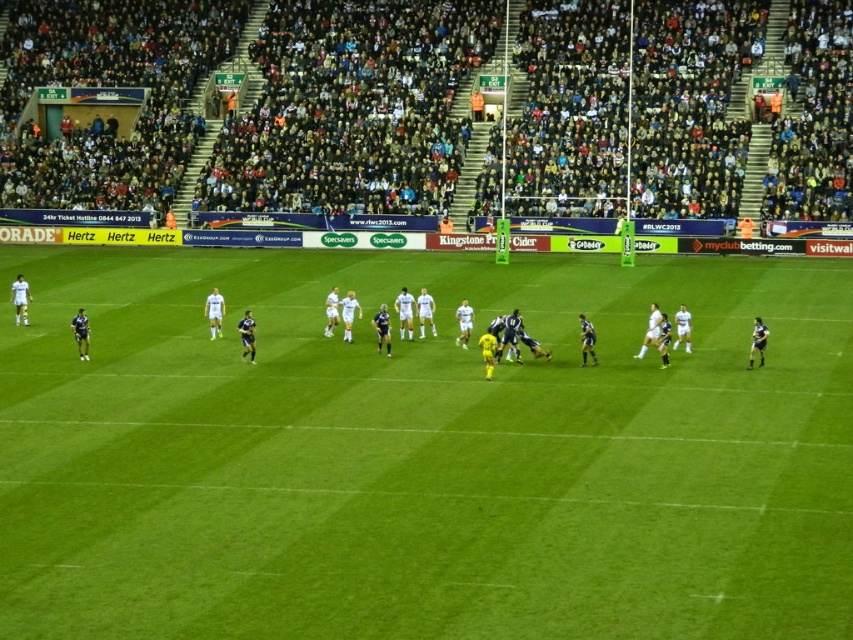
You are a player in the rugby match and want to pass the ball to your teammate. You are currently at point (x=747, y=605). Your teammate is at point (x=440, y=150). Which direction should you pass the ball to reach your teammate?

You should pass the ball towards point (x=440, y=150), which is behind point (x=747, y=605) since the teammate is located behind your current position.

You are a photographer standing at the camera position capturing the rugby match. You want to take a closeup shot of the point at coordinates (505, 388). Given that your zoom lens has a minimum focus distance of 20 meters, will you be able to focus on that point?

The point at coordinates (505, 388) is 22.48 meters from the camera. Since the minimum focus distance of your zoom lens is 20 meters, you can focus on the point as it is beyond the minimum required distance.